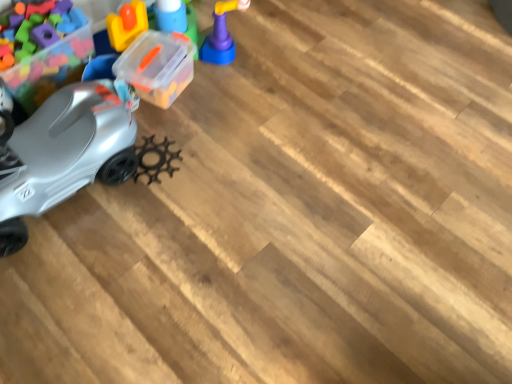
What do you see at coordinates (49, 68) in the screenshot? Image resolution: width=512 pixels, height=384 pixels. I see `metallic plastic car at left, acting as the 3th toy starting from the right` at bounding box center [49, 68].

Identify the location of metallic plastic car at left, acting as the 3th toy starting from the right. (49, 68).

At what (x,y) coordinates should I click in order to perform the action: click on silver matte car at left, the second toy when ordered from right to left. Please return your answer as a coordinate pair (x, y). This screenshot has height=384, width=512. Looking at the image, I should click on (84, 133).

Which is behind, silver matte car at left, the second toy when ordered from right to left, or metallic plastic car at left, the first toy when ordered from left to right?

metallic plastic car at left, the first toy when ordered from left to right, is more distant.

Is metallic plastic car at left, the first toy when ordered from left to right, completely or partially inside silver matte car at left, the 2th toy positioned from the left?

No, silver matte car at left, the 2th toy positioned from the left, does not contain metallic plastic car at left, the first toy when ordered from left to right.

Consider the image. Considering the relative sizes of silver matte car at left, the second toy when ordered from right to left, and metallic plastic car at left, acting as the 3th toy starting from the right, in the image provided, is silver matte car at left, the second toy when ordered from right to left, taller than metallic plastic car at left, acting as the 3th toy starting from the right,?

Indeed, silver matte car at left, the second toy when ordered from right to left, has a greater height compared to metallic plastic car at left, acting as the 3th toy starting from the right.

Between point (9, 122) and point (47, 92), which one is positioned behind?

The point (47, 92) is behind.

Is metallic plastic car at left, acting as the 3th toy starting from the right, aimed at matte purple toy at upper center, which appears as the 1th toy when viewed from the right?

No, metallic plastic car at left, acting as the 3th toy starting from the right, is not aimed at matte purple toy at upper center, which appears as the 1th toy when viewed from the right.

Does metallic plastic car at left, the first toy when ordered from left to right, have a lesser height compared to matte purple toy at upper center, which appears as the 3th toy when viewed from the left?

No.

From the image's perspective, does metallic plastic car at left, the first toy when ordered from left to right, appear higher than matte purple toy at upper center, which appears as the 1th toy when viewed from the right?

No, from the image's perspective, metallic plastic car at left, the first toy when ordered from left to right, is not on top of matte purple toy at upper center, which appears as the 1th toy when viewed from the right.

Considering their positions, is metallic plastic car at left, acting as the 3th toy starting from the right, located in front of or behind matte purple toy at upper center, which appears as the 3th toy when viewed from the left?

Visually, metallic plastic car at left, acting as the 3th toy starting from the right, is located in front of matte purple toy at upper center, which appears as the 3th toy when viewed from the left.

Does point (206, 55) appear closer or farther from the camera than point (63, 76)?

Point (206, 55) is positioned farther from the camera compared to point (63, 76).

This screenshot has height=384, width=512. In order to click on the 2nd toy to the right of the metallic plastic car at left, acting as the 3th toy starting from the right, starting your count from the anchor in this screenshot , I will do `click(221, 35)`.

Is matte purple toy at upper center, which appears as the 3th toy when viewed from the left, completely or partially outside of metallic plastic car at left, acting as the 3th toy starting from the right?

Yes, matte purple toy at upper center, which appears as the 3th toy when viewed from the left, is outside of metallic plastic car at left, acting as the 3th toy starting from the right.

From the picture: Measure the distance between matte purple toy at upper center, which appears as the 3th toy when viewed from the left, and metallic plastic car at left, acting as the 3th toy starting from the right.

matte purple toy at upper center, which appears as the 3th toy when viewed from the left, is 23.92 inches from metallic plastic car at left, acting as the 3th toy starting from the right.

Is matte purple toy at upper center, which appears as the 3th toy when viewed from the left, not inside silver matte car at left, the second toy when ordered from right to left?

Absolutely, matte purple toy at upper center, which appears as the 3th toy when viewed from the left, is external to silver matte car at left, the second toy when ordered from right to left.

Locate an element on the screen. The height and width of the screenshot is (384, 512). the 2nd toy above when counting from the silver matte car at left, the second toy when ordered from right to left (from the image's perspective) is located at coordinates (221, 35).

Is matte purple toy at upper center, which appears as the 1th toy when viewed from the right, aimed at silver matte car at left, the second toy when ordered from right to left?

No, matte purple toy at upper center, which appears as the 1th toy when viewed from the right, is not turned towards silver matte car at left, the second toy when ordered from right to left.

Measure the distance between matte purple toy at upper center, which appears as the 3th toy when viewed from the left, and silver matte car at left, the second toy when ordered from right to left.

They are 21.21 inches apart.

Considering the sizes of objects metallic plastic car at left, acting as the 3th toy starting from the right, and silver matte car at left, the second toy when ordered from right to left, in the image provided, who is taller, metallic plastic car at left, acting as the 3th toy starting from the right, or silver matte car at left, the second toy when ordered from right to left,?

silver matte car at left, the second toy when ordered from right to left.

Is metallic plastic car at left, acting as the 3th toy starting from the right, to the left of silver matte car at left, the second toy when ordered from right to left, from the viewer's perspective?

Correct, you'll find metallic plastic car at left, acting as the 3th toy starting from the right, to the left of silver matte car at left, the second toy when ordered from right to left.

Is metallic plastic car at left, acting as the 3th toy starting from the right, bigger than silver matte car at left, the 2th toy positioned from the left?

Actually, metallic plastic car at left, acting as the 3th toy starting from the right, might be smaller than silver matte car at left, the 2th toy positioned from the left.

Is metallic plastic car at left, the first toy when ordered from left to right, oriented away from silver matte car at left, the second toy when ordered from right to left?

Answer: That's not correct — metallic plastic car at left, the first toy when ordered from left to right, is not looking away from silver matte car at left, the second toy when ordered from right to left.

Considering the positions of objects silver matte car at left, the second toy when ordered from right to left, and matte purple toy at upper center, which appears as the 3th toy when viewed from the left, in the image provided, who is more to the right, silver matte car at left, the second toy when ordered from right to left, or matte purple toy at upper center, which appears as the 3th toy when viewed from the left,?

matte purple toy at upper center, which appears as the 3th toy when viewed from the left.

In the scene shown: From the image's perspective, is silver matte car at left, the second toy when ordered from right to left, positioned above or below matte purple toy at upper center, which appears as the 3th toy when viewed from the left?

From the image's perspective, silver matte car at left, the second toy when ordered from right to left, appears below matte purple toy at upper center, which appears as the 3th toy when viewed from the left.

In terms of width, does silver matte car at left, the 2th toy positioned from the left, look wider or thinner when compared to matte purple toy at upper center, which appears as the 1th toy when viewed from the right?

Clearly, silver matte car at left, the 2th toy positioned from the left, has more width compared to matte purple toy at upper center, which appears as the 1th toy when viewed from the right.

Choose the correct answer: Is silver matte car at left, the 2th toy positioned from the left, inside matte purple toy at upper center, which appears as the 3th toy when viewed from the left, or outside it?

silver matte car at left, the 2th toy positioned from the left, exists outside the volume of matte purple toy at upper center, which appears as the 3th toy when viewed from the left.

This screenshot has height=384, width=512. What are the coordinates of `the 1st toy below the silver matte car at left, the second toy when ordered from right to left (from a real-world perspective)` in the screenshot? It's located at (49, 68).

Locate an element on the screen. This screenshot has width=512, height=384. toy located above the metallic plastic car at left, acting as the 3th toy starting from the right (from the image's perspective) is located at coordinates pos(221,35).

Looking at the image, which one is located further to metallic plastic car at left, the first toy when ordered from left to right, silver matte car at left, the second toy when ordered from right to left, or matte purple toy at upper center, which appears as the 3th toy when viewed from the left?

Among the two, matte purple toy at upper center, which appears as the 3th toy when viewed from the left, is located further to metallic plastic car at left, the first toy when ordered from left to right.

Which object lies further to the anchor point silver matte car at left, the second toy when ordered from right to left, metallic plastic car at left, acting as the 3th toy starting from the right, or matte purple toy at upper center, which appears as the 3th toy when viewed from the left?

matte purple toy at upper center, which appears as the 3th toy when viewed from the left, is positioned further to the anchor silver matte car at left, the second toy when ordered from right to left.

Based on their spatial positions, is silver matte car at left, the second toy when ordered from right to left, or metallic plastic car at left, the first toy when ordered from left to right, closer to matte purple toy at upper center, which appears as the 1th toy when viewed from the right?

silver matte car at left, the second toy when ordered from right to left, lies closer to matte purple toy at upper center, which appears as the 1th toy when viewed from the right, than the other object.

Considering their positions, is matte purple toy at upper center, which appears as the 1th toy when viewed from the right, positioned further to metallic plastic car at left, the first toy when ordered from left to right, than silver matte car at left, the 2th toy positioned from the left?

matte purple toy at upper center, which appears as the 1th toy when viewed from the right, lies further to metallic plastic car at left, the first toy when ordered from left to right, than the other object.

Considering their positions, is matte purple toy at upper center, which appears as the 1th toy when viewed from the right, positioned further to silver matte car at left, the 2th toy positioned from the left, than metallic plastic car at left, acting as the 3th toy starting from the right?

matte purple toy at upper center, which appears as the 1th toy when viewed from the right, lies further to silver matte car at left, the 2th toy positioned from the left, than the other object.

Which object lies further to the anchor point matte purple toy at upper center, which appears as the 3th toy when viewed from the left, metallic plastic car at left, the first toy when ordered from left to right, or silver matte car at left, the second toy when ordered from right to left?

Based on the image, metallic plastic car at left, the first toy when ordered from left to right, appears to be further to matte purple toy at upper center, which appears as the 3th toy when viewed from the left.

Identify the location of toy located between metallic plastic car at left, acting as the 3th toy starting from the right, and matte purple toy at upper center, which appears as the 3th toy when viewed from the left, in the left-right direction. (84, 133).